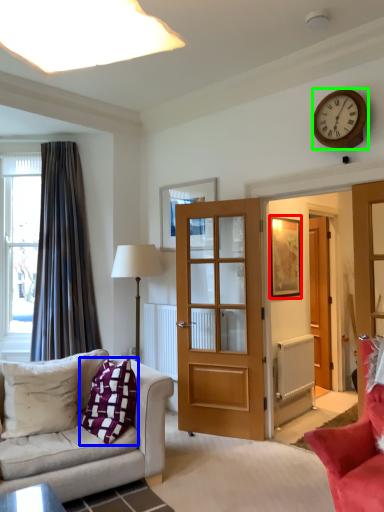
Question: Which object is the closest to the picture frame (highlighted by a red box)? Choose among these: pillow (highlighted by a blue box) or wall clock (highlighted by a green box).

Choices:
 (A) pillow
 (B) wall clock

Answer: (B)